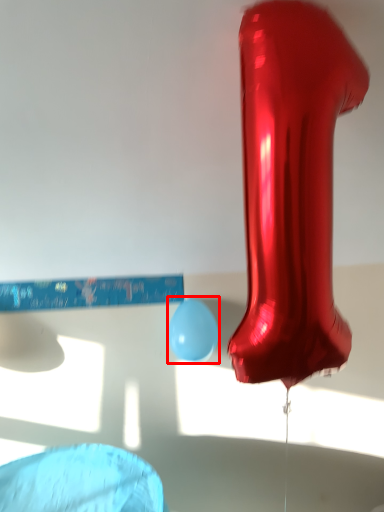
Question: From the image's perspective, what is the correct spatial relationship of balloon (annotated by the red box) in relation to footwear?

Choices:
 (A) above
 (B) below

Answer: (B)